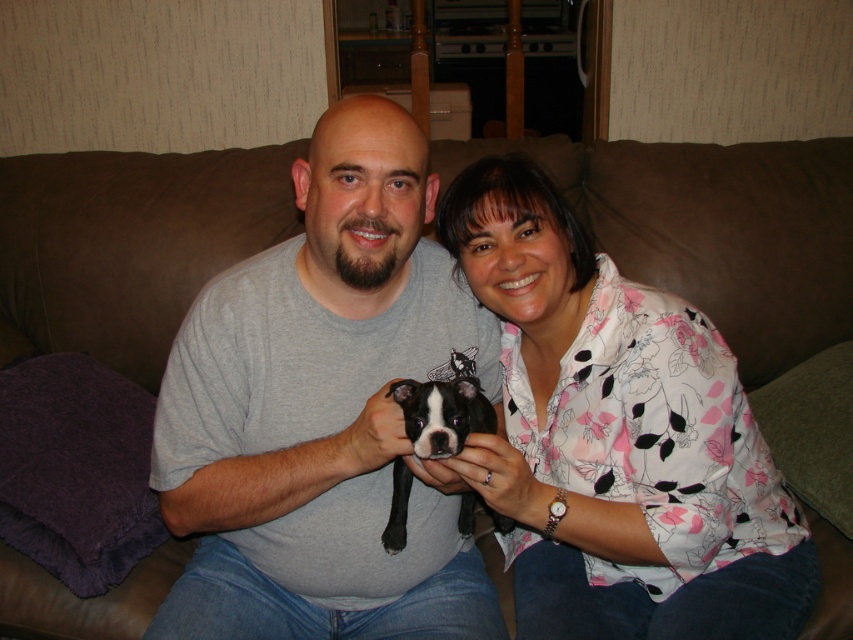
Question: Which of the following is the farthest from the observer?

Choices:
 (A) gray cotton shirt at center
 (B) black fur dog at center
 (C) jeans at center
 (D) floral shirt at center

Answer: (C)

Question: Which of the following is the farthest from the observer?

Choices:
 (A) (618, 624)
 (B) (473, 404)
 (C) (384, 566)

Answer: (C)

Question: Can you confirm if gray cotton shirt at center is positioned above black fur dog at center?

Choices:
 (A) no
 (B) yes

Answer: (B)

Question: Which object is positioned closest to the black fur dog at center?

Choices:
 (A) gray cotton shirt at center
 (B) jeans at center
 (C) floral shirt at center

Answer: (A)

Question: Is jeans at center closer to camera compared to black fur dog at center?

Choices:
 (A) no
 (B) yes

Answer: (A)

Question: Does floral shirt at center appear under jeans at center?

Choices:
 (A) yes
 (B) no

Answer: (B)